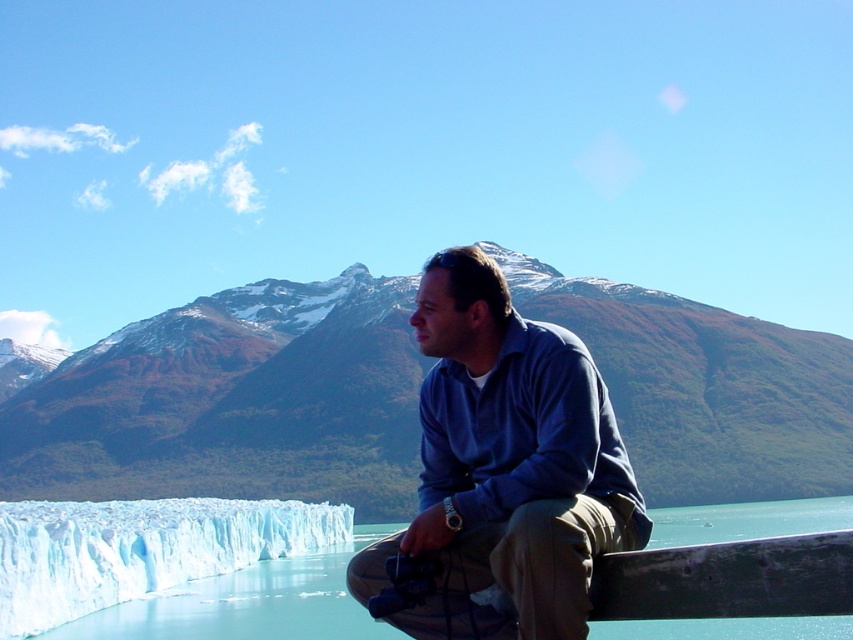
Between snowy rocky mountain at center and blue cotton shirt at center, which one appears on the right side from the viewer's perspective?

Positioned to the right is blue cotton shirt at center.

Is snowy rocky mountain at center below blue cotton shirt at center?

Yes, snowy rocky mountain at center is below blue cotton shirt at center.

Is point (715, 483) more distant than point (456, 460)?

Yes.

The height and width of the screenshot is (640, 853). Identify the location of snowy rocky mountain at center. (233, 403).

Does point (224, 310) come behind point (38, 611)?

Yes, it is.

Based on the photo, is snowy rocky mountain at center to the right of white ice at lower left from the viewer's perspective?

Incorrect, snowy rocky mountain at center is not on the right side of white ice at lower left.

Which is behind, point (15, 448) or point (41, 564)?

The point (15, 448) is behind.

Find the location of a particular element. snowy rocky mountain at center is located at coordinates pyautogui.click(x=233, y=403).

Between blue cotton shirt at center and transparent ice water at lower left, which one has less height?

Standing shorter between the two is blue cotton shirt at center.

Does blue cotton shirt at center come behind transparent ice water at lower left?

Yes.

Between point (358, 582) and point (844, 515), which one is positioned behind?

The point (844, 515) is behind.

You are a GUI agent. You are given a task and a screenshot of the screen. Output one action in this format:
    pyautogui.click(x=<x>, y=<y>)
    Task: Click on the blue cotton shirt at center
    This screenshot has height=640, width=853.
    Given the screenshot: What is the action you would take?
    pyautogui.click(x=509, y=456)